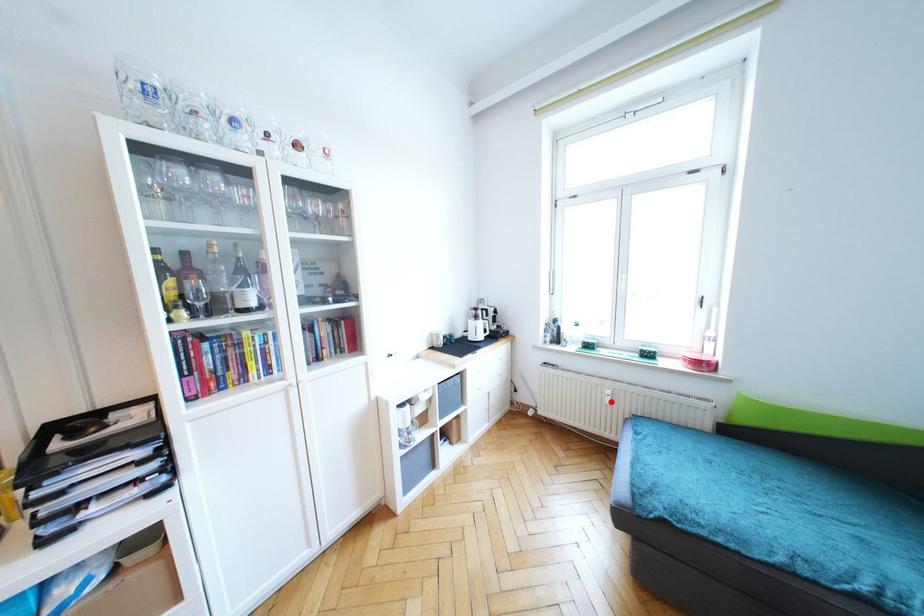
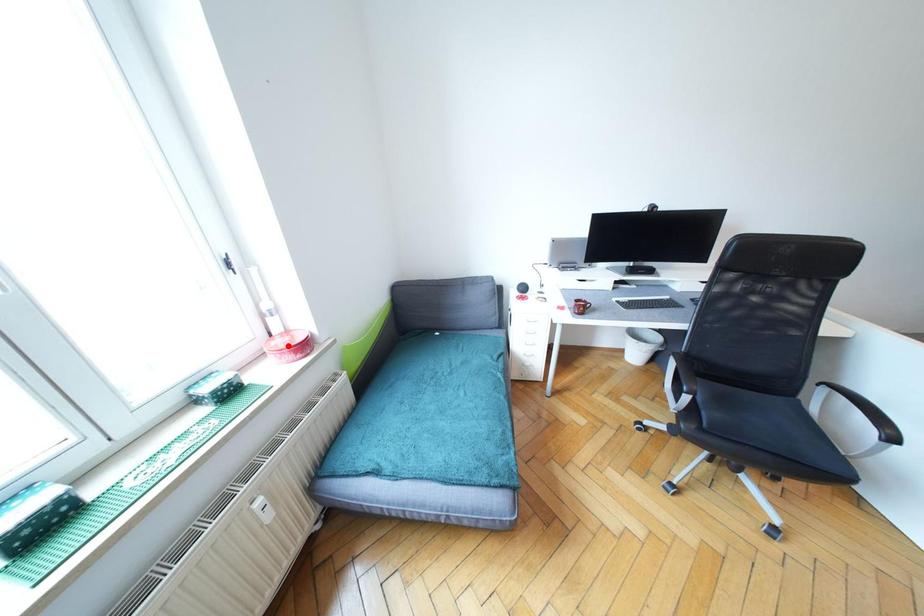
I am providing you with two images of the same scene from different viewpoints. A red point is marked on the first image and another point is marked on the second image. Is the marked point in image1 the same physical position as the marked point in image2?

No